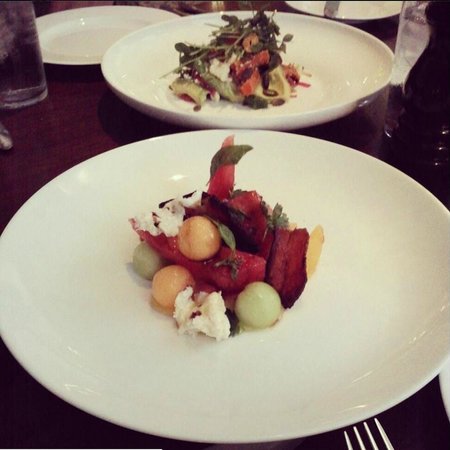
Find the location of a particular element. The width and height of the screenshot is (450, 450). glass is located at coordinates (346, 60), (83, 24), (343, 338).